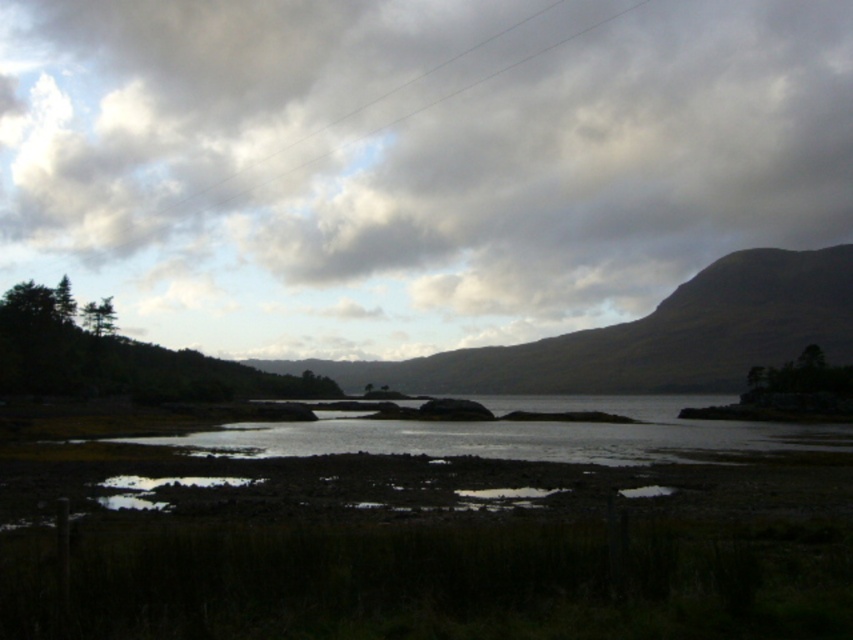
Question: Which point is farther to the camera?

Choices:
 (A) clear water at center
 (B) green grassy hill at upper center
 (C) shiny metallic puddle at lower center
 (D) cloudy sky at upper center

Answer: (B)

Question: Can you confirm if green grassy hill at upper center is positioned to the right of clear water at center?

Choices:
 (A) no
 (B) yes

Answer: (A)

Question: Considering the real-world distances, which object is farthest from the green grassy hill at upper center?

Choices:
 (A) shiny metallic puddle at lower center
 (B) cloudy sky at upper center

Answer: (A)

Question: Can you confirm if cloudy sky at upper center is smaller than clear water at center?

Choices:
 (A) no
 (B) yes

Answer: (A)

Question: Is cloudy sky at upper center further to camera compared to green grassy hill at upper center?

Choices:
 (A) yes
 (B) no

Answer: (B)

Question: Estimate the real-world distances between objects in this image. Which object is farther from the clear water at center?

Choices:
 (A) cloudy sky at upper center
 (B) green grassy hill at upper center

Answer: (A)